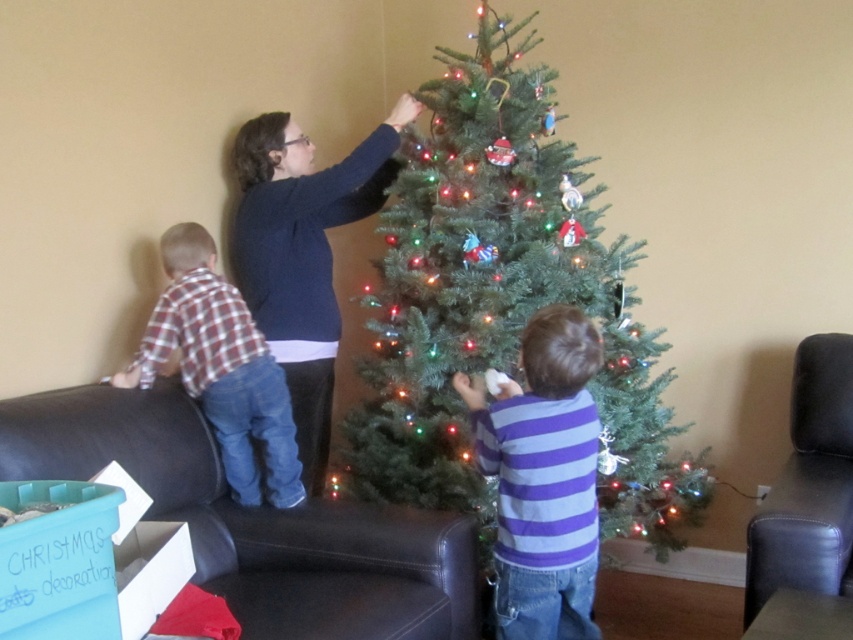
You are a photographer standing in the living room and want to take a photo of the dark blue sweater at upper center and the plaid fabric shirt at left. Which one is closer to the camera?

The dark blue sweater at upper center is closer to the camera because the plaid fabric shirt at left is behind it.

You are a photographer standing in front of the Christmas tree. You want to take a photo that includes both the purple striped shirt at center and the plaid fabric shirt at left. Which shirt should you focus on first to ensure both are in the frame?

You should focus on the purple striped shirt at center first because it is closer to the viewer than the plaid fabric shirt at left, so adjusting the camera to its distance will help capture both shirts in the frame.